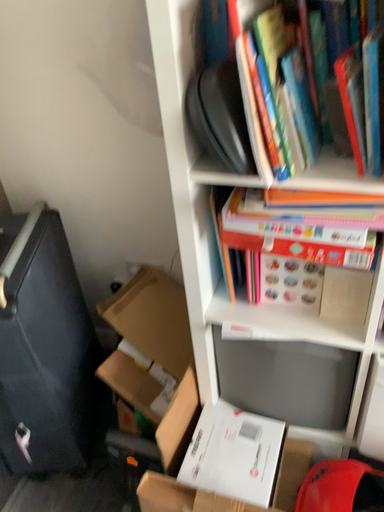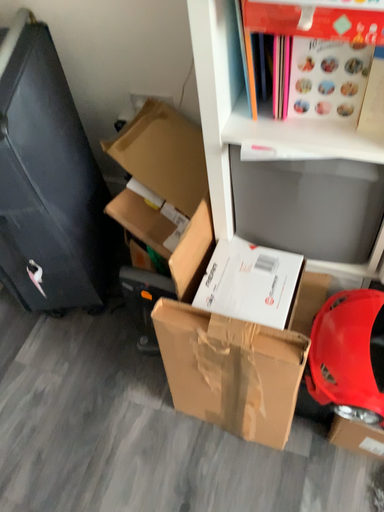
Question: How did the camera likely rotate when shooting the video?

Choices:
 (A) rotated downward
 (B) rotated upward

Answer: (A)